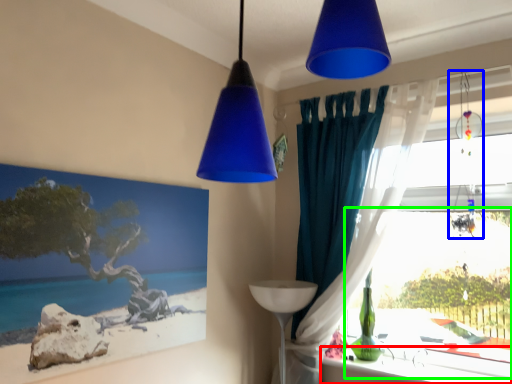
Question: Estimate the real-world distances between objects in this image. Which object is closer to window sill (highlighted by a red box), lamp (highlighted by a blue box) or bay window (highlighted by a green box)?

Choices:
 (A) lamp
 (B) bay window

Answer: (B)